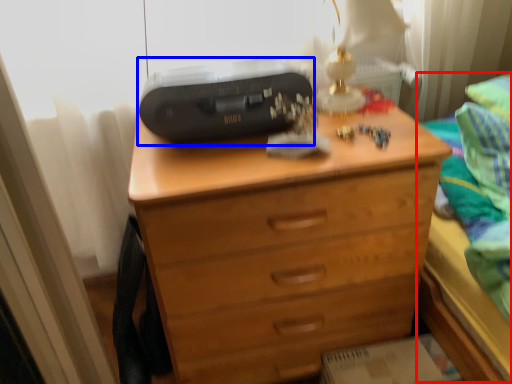
Question: Which object is closer to the camera taking this photo, bed (highlighted by a red box) or printer (highlighted by a blue box)?

Choices:
 (A) bed
 (B) printer

Answer: (A)